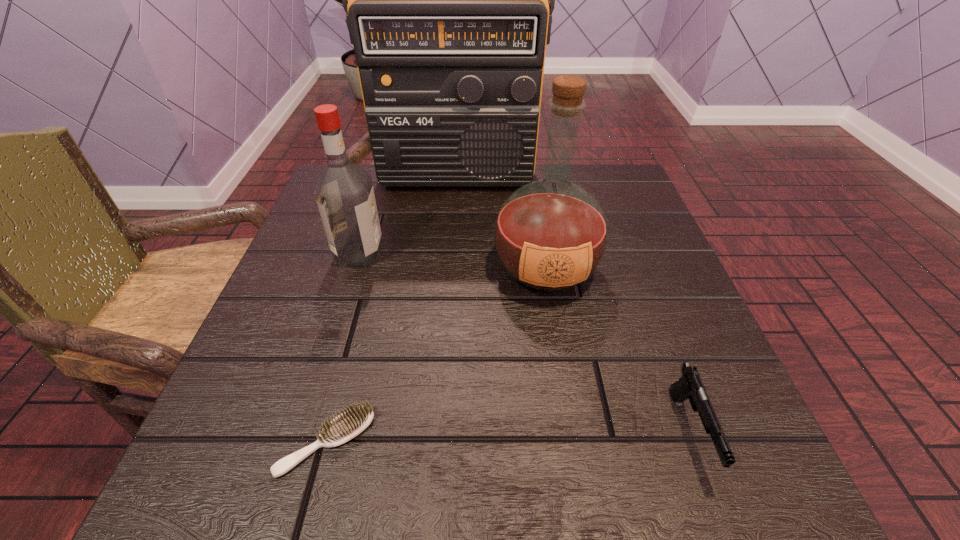
Identify the location of free spot between the taller liquor and the third tallest object. (452, 261).

Where is `vacant area between the right liquor and the fourth tallest object`? The image size is (960, 540). vacant area between the right liquor and the fourth tallest object is located at coordinates (617, 350).

Where is `vacant area that lies between the radio receiver and the scrubbing brush`? The width and height of the screenshot is (960, 540). vacant area that lies between the radio receiver and the scrubbing brush is located at coordinates (391, 310).

Image resolution: width=960 pixels, height=540 pixels. I want to click on free space that is in between the right liquor and the rightmost object, so click(617, 350).

Identify the location of vacant space in between the fourth shortest object and the shortest object. The height and width of the screenshot is (540, 960). [436, 355].

The width and height of the screenshot is (960, 540). I want to click on free area in between the scrubbing brush and the gun, so click(508, 437).

Where is `free space between the scrubbing brush and the fourth tallest object`? Image resolution: width=960 pixels, height=540 pixels. free space between the scrubbing brush and the fourth tallest object is located at coordinates (508, 437).

Where is `unoccupied area between the rightmost object and the shorter liquor`? unoccupied area between the rightmost object and the shorter liquor is located at coordinates (524, 342).

I want to click on empty location between the shorter liquor and the right liquor, so click(x=452, y=261).

At what (x,y) coordinates should I click in order to perform the action: click on object that stands as the closest to the rightmost object. Please return your answer as a coordinate pair (x, y). Looking at the image, I should click on 550,235.